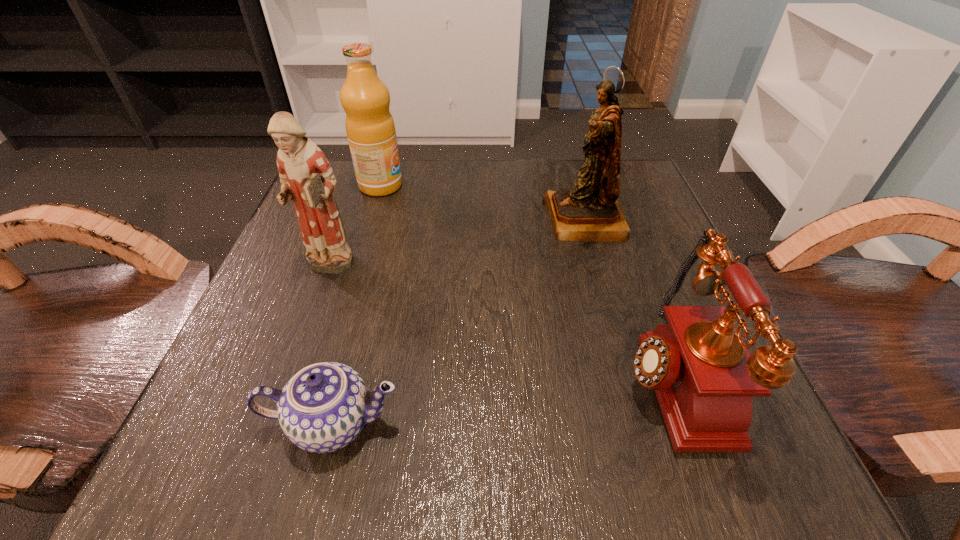
Where is `chinaware that is at the left edge`? The height and width of the screenshot is (540, 960). chinaware that is at the left edge is located at coordinates (322, 408).

Locate an element on the screen. The height and width of the screenshot is (540, 960). figurine that is at the right edge is located at coordinates (590, 212).

Find the location of a particular element. This screenshot has height=540, width=960. telephone situated at the right edge is located at coordinates (704, 377).

The image size is (960, 540). What are the coordinates of `object at the far left corner` in the screenshot? It's located at (370, 128).

This screenshot has width=960, height=540. What are the coordinates of `object that is at the near left corner` in the screenshot? It's located at (322, 408).

In order to click on object situated at the far right corner in this screenshot , I will do `click(590, 212)`.

Image resolution: width=960 pixels, height=540 pixels. I want to click on object present at the near right corner, so click(704, 377).

Find the location of `blank space at the far edge of the desktop`. blank space at the far edge of the desktop is located at coordinates (560, 179).

At what (x,y) coordinates should I click in order to perform the action: click on blank space at the near edge. Please return your answer as a coordinate pair (x, y). Image resolution: width=960 pixels, height=540 pixels. Looking at the image, I should click on (329, 463).

The height and width of the screenshot is (540, 960). Identify the location of free location at the left edge. (242, 360).